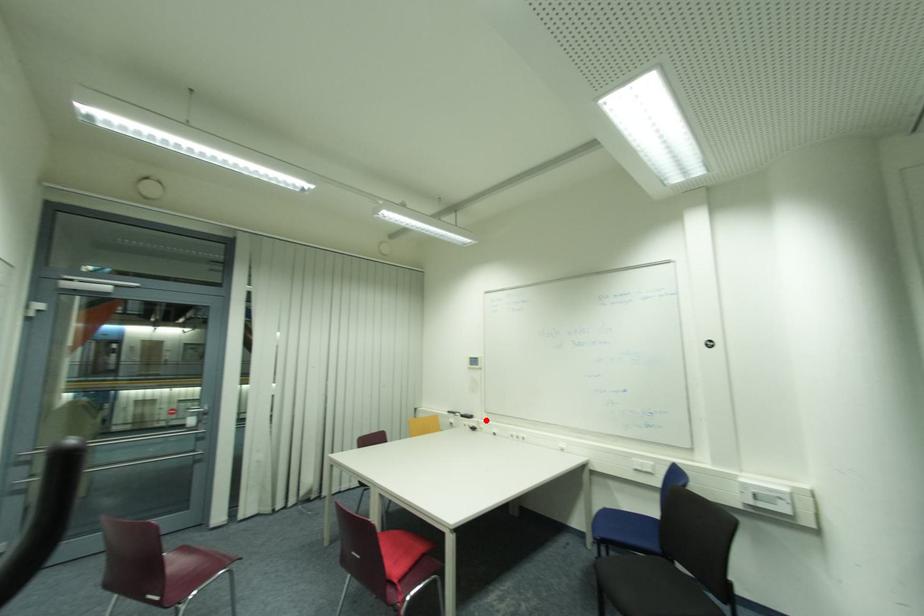
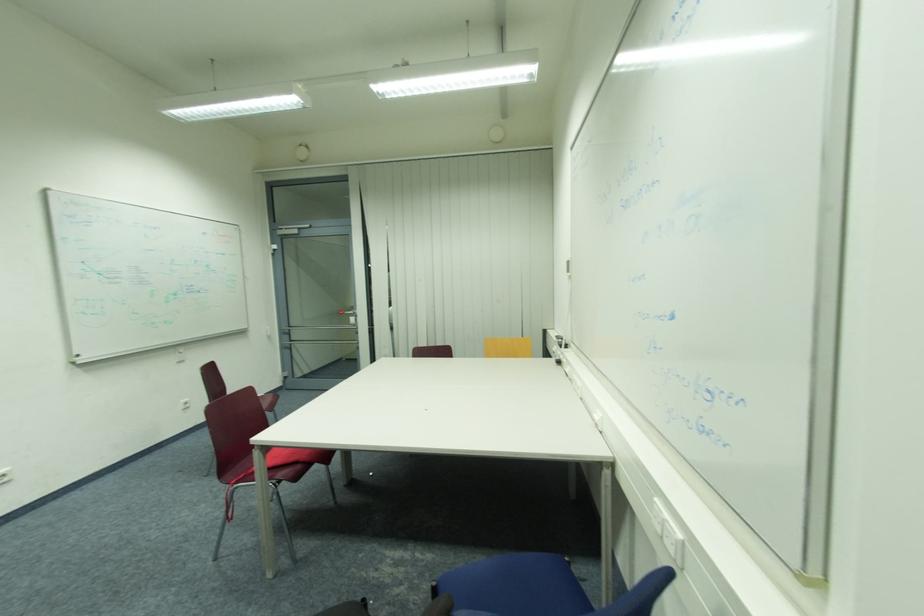
Find the pixel in the second image that matches the highlighted location in the first image.

(578, 352)